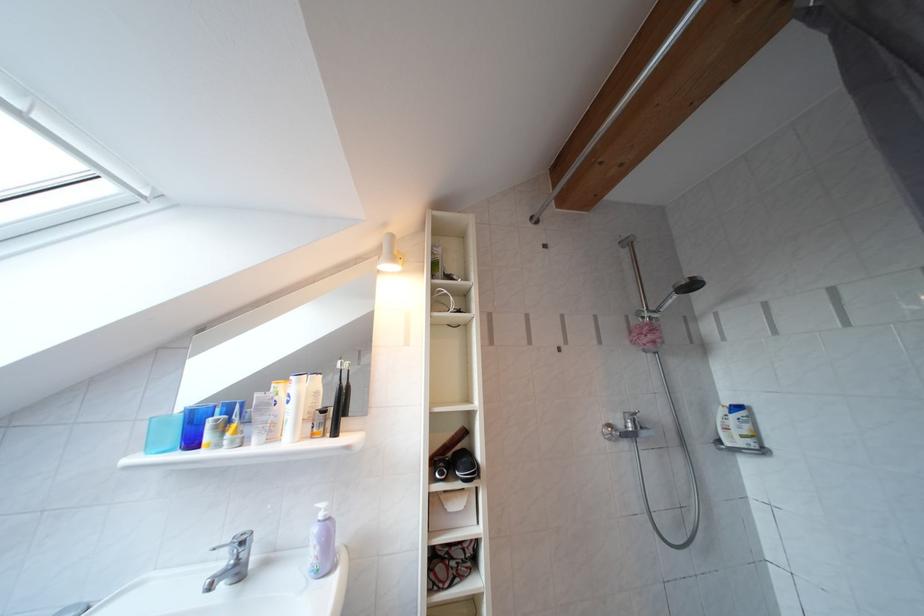
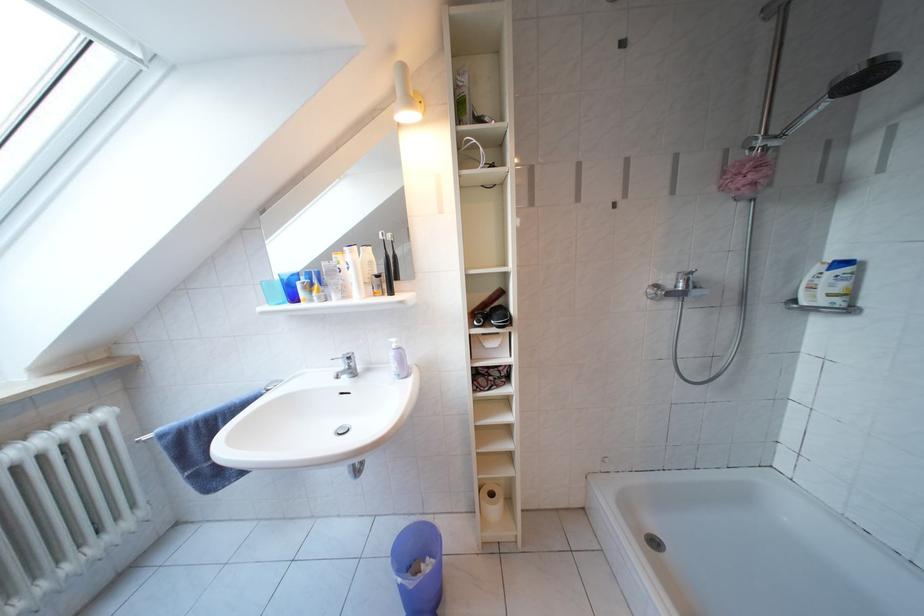
Locate, in the second image, the point that corresponds to the point at 699,291 in the first image.

(876, 82)